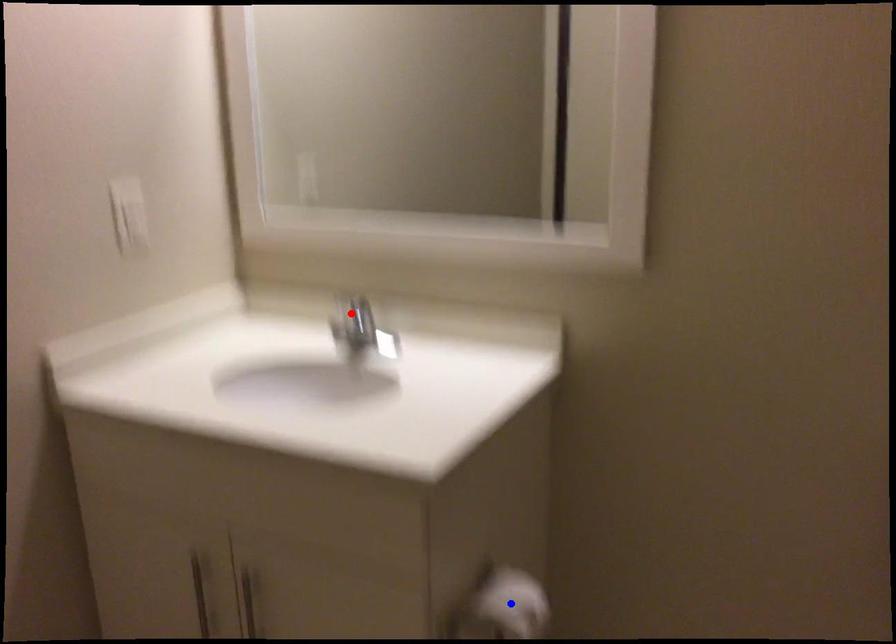
Question: In the image, two points are highlighted. Which point is nearer to the camera? Reply with the corresponding letter.

Choices:
 (A) blue point
 (B) red point

Answer: (A)